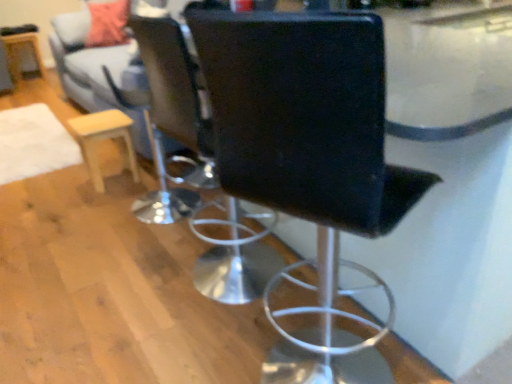
Image resolution: width=512 pixels, height=384 pixels. What do you see at coordinates (101, 73) in the screenshot? I see `light gray fabric couch at upper left` at bounding box center [101, 73].

The image size is (512, 384). Describe the element at coordinates (309, 163) in the screenshot. I see `black leather chair at center, the 1th chair in the front-to-back sequence` at that location.

In order to face black leather chair at center, the 1th chair in the front-to-back sequence, should I rotate leftwards or rightwards?

Turn right by 9.454 degrees to look at black leather chair at center, the 1th chair in the front-to-back sequence.

Find the location of `light gray fabric couch at upper left`. light gray fabric couch at upper left is located at coordinates (101, 73).

From the image's perspective, which is below, light gray fabric couch at upper left or black leather chair at center, the 2th chair when ordered from back to front?

black leather chair at center, the 2th chair when ordered from back to front, appears lower in the image.

Is light gray fabric couch at upper left far from black leather chair at center, the 2th chair when ordered from back to front?

Absolutely, light gray fabric couch at upper left is distant from black leather chair at center, the 2th chair when ordered from back to front.

Is light gray fabric couch at upper left to the left of black leather chair at center, the 2th chair when ordered from back to front, from the viewer's perspective?

Yes, light gray fabric couch at upper left is to the left of black leather chair at center, the 2th chair when ordered from back to front.

Is light gray fabric couch at upper left inside the boundaries of black leather chair at center, the 2th chair when ordered from back to front, or outside?

light gray fabric couch at upper left exists outside the volume of black leather chair at center, the 2th chair when ordered from back to front.

From the picture: Which of these two, light wood/finely finished stool at left or wooden round table at left, is thinner?

light wood/finely finished stool at left is thinner.

Is light wood/finely finished stool at left in front of wooden round table at left?

Yes, light wood/finely finished stool at left is in front of wooden round table at left.

Who is smaller, light wood/finely finished stool at left or wooden round table at left?

light wood/finely finished stool at left.

Is light wood/finely finished stool at left in contact with wooden round table at left?

light wood/finely finished stool at left and wooden round table at left are not in contact.

From a real-world perspective, who is located higher, light wood/finely finished stool at left or light gray fabric couch at upper left?

light gray fabric couch at upper left.

Which is closer to the camera, (x=92, y=170) or (x=181, y=147)?

Point (x=92, y=170) is positioned farther from the camera compared to point (x=181, y=147).

Which of these two, light wood/finely finished stool at left or light gray fabric couch at upper left, stands taller?

light gray fabric couch at upper left.

Considering the sizes of objects light wood/finely finished stool at left and light gray fabric couch at upper left in the image provided, who is thinner, light wood/finely finished stool at left or light gray fabric couch at upper left?

With smaller width is light wood/finely finished stool at left.

Identify the location of round table that appears behind the black leather chair at center, the 2th chair when ordered from back to front. The width and height of the screenshot is (512, 384). (20, 53).

Between black leather chair at center, the 1th chair in the front-to-back sequence, and wooden round table at left, which one has less height?

wooden round table at left is shorter.

Which object is further away from the camera taking this photo, black leather chair at center, the 1th chair in the front-to-back sequence, or wooden round table at left?

wooden round table at left.

From the image's perspective, which one is positioned lower, black leather chair at center, the 2th chair positioned from the front, or black leather chair at center, the 2th chair when ordered from back to front?

black leather chair at center, the 2th chair when ordered from back to front.

Based on the photo, is black leather chair at center, the 2th chair positioned from the front, taller or shorter than black leather chair at center, the 2th chair when ordered from back to front?

black leather chair at center, the 2th chair positioned from the front, is shorter than black leather chair at center, the 2th chair when ordered from back to front.

I want to click on chair lying on the right of black leather chair at center, arranged as the first chair when viewed from the back, so [x=309, y=163].

Which is behind, point (14, 52) or point (278, 310)?

The point (14, 52) is more distant.

Identify the location of round table below the black leather chair at center, the 1th chair in the front-to-back sequence (from a real-world perspective). This screenshot has height=384, width=512. (20, 53).

Is wooden round table at left not inside black leather chair at center, the 2th chair when ordered from back to front?

wooden round table at left is positioned outside black leather chair at center, the 2th chair when ordered from back to front.

Who is more distant, wooden round table at left or black leather chair at center, the 1th chair in the front-to-back sequence?

wooden round table at left is further from the camera.

Can you confirm if light wood/finely finished stool at left is shorter than black leather chair at center, the 2th chair positioned from the front?

Indeed, light wood/finely finished stool at left has a lesser height compared to black leather chair at center, the 2th chair positioned from the front.

Considering the relative sizes of light wood/finely finished stool at left and black leather chair at center, the 2th chair positioned from the front, in the image provided, is light wood/finely finished stool at left thinner than black leather chair at center, the 2th chair positioned from the front,?

Indeed, light wood/finely finished stool at left has a lesser width compared to black leather chair at center, the 2th chair positioned from the front.

Looking at the image, does light wood/finely finished stool at left seem bigger or smaller compared to black leather chair at center, the 2th chair positioned from the front?

Clearly, light wood/finely finished stool at left is smaller in size than black leather chair at center, the 2th chair positioned from the front.

From a real-world perspective, relative to black leather chair at center, the 2th chair positioned from the front, is light wood/finely finished stool at left vertically above or below?

From a real-world perspective, light wood/finely finished stool at left is physically below black leather chair at center, the 2th chair positioned from the front.

Find the location of a particular element. This screenshot has width=512, height=384. couch located above the black leather chair at center, the 1th chair in the front-to-back sequence (from the image's perspective) is located at coordinates tap(101, 73).

At what (x,y) coordinates should I click in order to perform the action: click on furniture below the wooden round table at left (from the image's perspective). Please return your answer as a coordinate pair (x, y). The height and width of the screenshot is (384, 512). Looking at the image, I should click on (104, 139).

Looking at the image, which one is located closer to wooden round table at left, light wood/finely finished stool at left or black leather chair at center, arranged as the first chair when viewed from the back?

Based on the image, light wood/finely finished stool at left appears to be nearer to wooden round table at left.

From the image, which object appears to be nearer to black leather chair at center, the 2th chair positioned from the front, wooden round table at left or black leather chair at center, the 2th chair when ordered from back to front?

black leather chair at center, the 2th chair when ordered from back to front.

Looking at the image, which one is located further to black leather chair at center, the 2th chair when ordered from back to front, light wood/finely finished stool at left or wooden round table at left?

wooden round table at left is positioned further to the anchor black leather chair at center, the 2th chair when ordered from back to front.

Considering their positions, is light gray fabric couch at upper left positioned closer to black leather chair at center, arranged as the first chair when viewed from the back, than light wood/finely finished stool at left?

The object closer to black leather chair at center, arranged as the first chair when viewed from the back, is light wood/finely finished stool at left.

Estimate the real-world distances between objects in this image. Which object is further from black leather chair at center, arranged as the first chair when viewed from the back, wooden round table at left or light gray fabric couch at upper left?

wooden round table at left.

Based on their spatial positions, is light gray fabric couch at upper left or black leather chair at center, the 2th chair positioned from the front, further from light wood/finely finished stool at left?

black leather chair at center, the 2th chair positioned from the front, lies further to light wood/finely finished stool at left than the other object.

From the image, which object appears to be farther from light gray fabric couch at upper left, black leather chair at center, the 1th chair in the front-to-back sequence, or wooden round table at left?

The object further to light gray fabric couch at upper left is wooden round table at left.

When comparing their distances from light gray fabric couch at upper left, does light wood/finely finished stool at left or black leather chair at center, the 1th chair in the front-to-back sequence, seem closer?

light wood/finely finished stool at left is positioned closer to the anchor light gray fabric couch at upper left.

The height and width of the screenshot is (384, 512). I want to click on couch between black leather chair at center, the 1th chair in the front-to-back sequence, and light wood/finely finished stool at left, along the z-axis, so click(101, 73).

The height and width of the screenshot is (384, 512). Find the location of `couch positioned between black leather chair at center, the 2th chair when ordered from back to front, and wooden round table at left from near to far`. couch positioned between black leather chair at center, the 2th chair when ordered from back to front, and wooden round table at left from near to far is located at coordinates (101, 73).

At what (x,y) coordinates should I click in order to perform the action: click on chair between black leather chair at center, the 1th chair in the front-to-back sequence, and light gray fabric couch at upper left, along the z-axis. Please return your answer as a coordinate pair (x, y). The width and height of the screenshot is (512, 384). Looking at the image, I should click on (x=176, y=92).

Find the location of a particular element. furniture located between black leather chair at center, the 1th chair in the front-to-back sequence, and wooden round table at left in the depth direction is located at coordinates (104, 139).